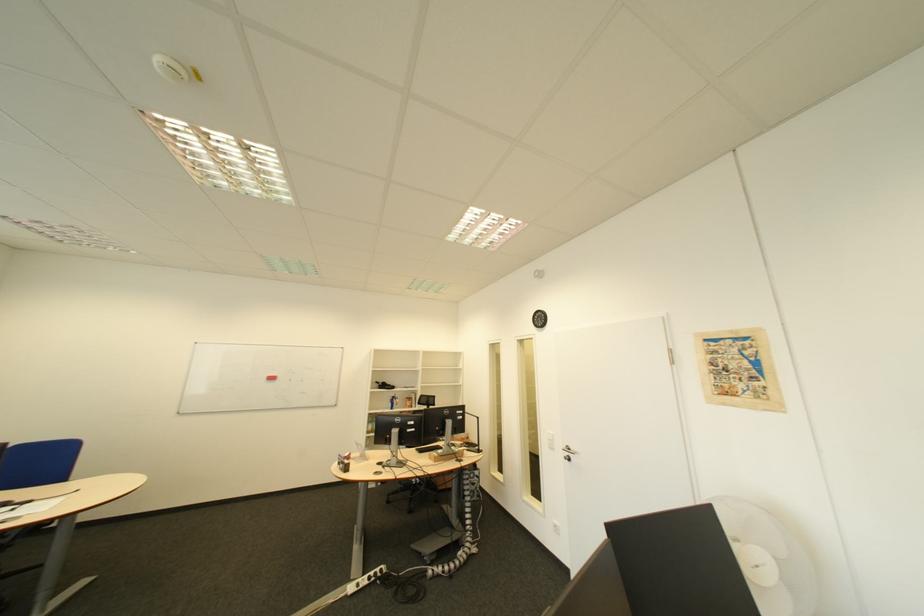
What do you see at coordinates (38, 464) in the screenshot? The width and height of the screenshot is (924, 616). I see `the blue chair sitting surface` at bounding box center [38, 464].